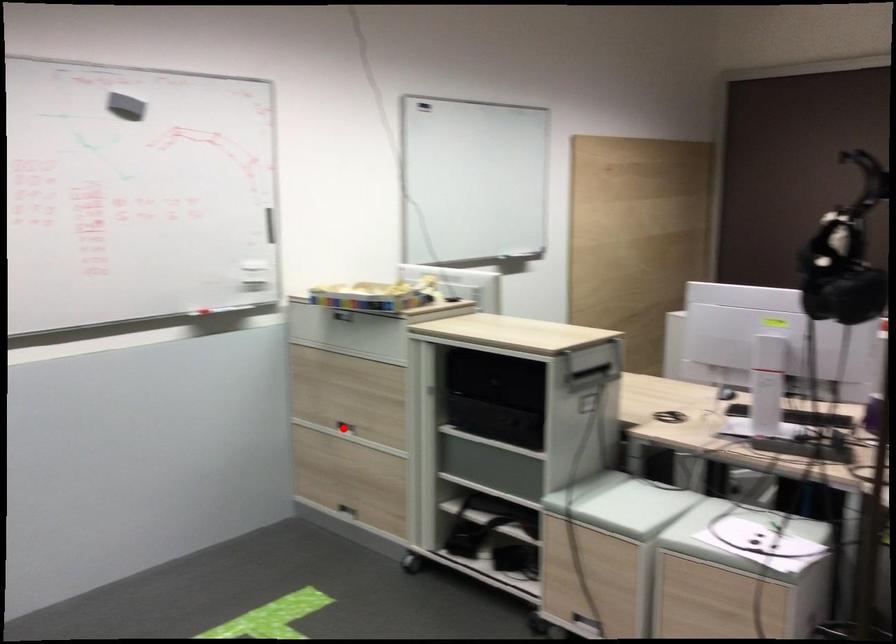
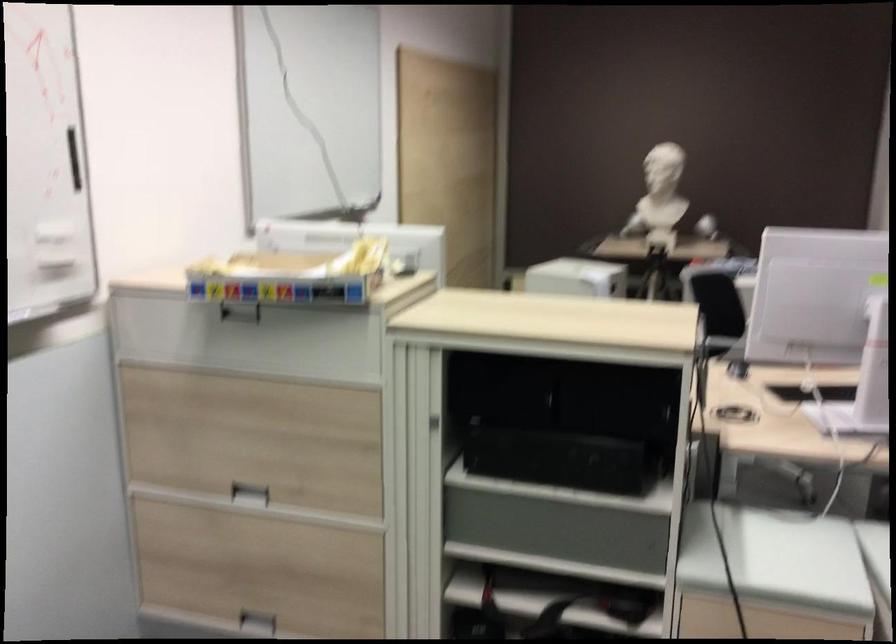
Question: I am providing you with two images of the same scene from different viewpoints. A red point is shown in image1. For the corresponding object point in image2, is it positioned nearer or farther from the camera?

Choices:
 (A) Nearer
 (B) Farther

Answer: (A)